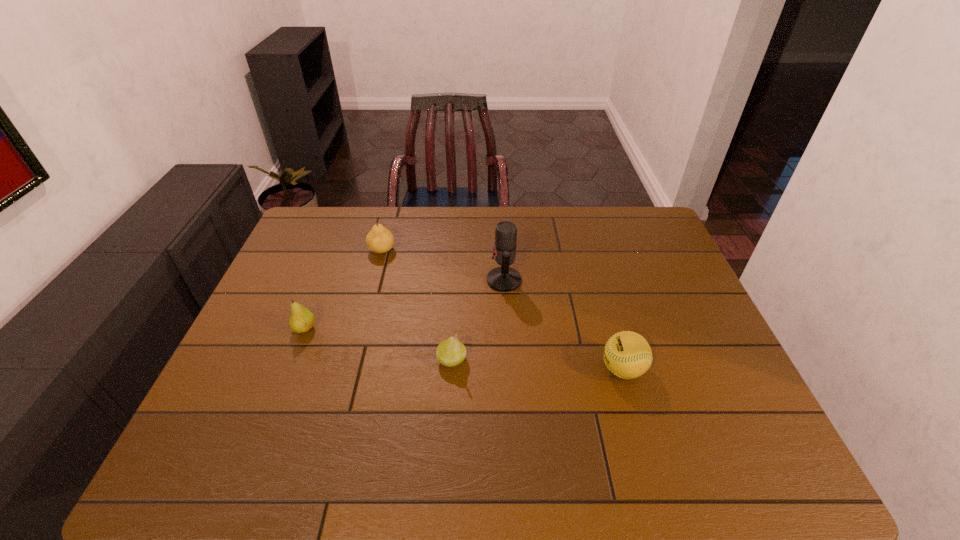
Locate an element on the screen. The height and width of the screenshot is (540, 960). the fourth closest object relative to the rightmost object is located at coordinates (301, 320).

Find the location of a particular element. The image size is (960, 540). the fourth closest object to the nearest pear is located at coordinates (379, 240).

Locate which pear is the third closest to the second object from right to left. Please provide its 2D coordinates. Your answer should be formatted as a tuple, i.e. [(x, y)], where the tuple contains the x and y coordinates of a point satisfying the conditions above.

[(301, 320)]

Identify which pear is the second closest to the farthest object. Please provide its 2D coordinates. Your answer should be formatted as a tuple, i.e. [(x, y)], where the tuple contains the x and y coordinates of a point satisfying the conditions above.

[(451, 352)]

Find the location of `blank space that satisfies the following two spatial constraints: 1. on the back side of the second pear from right to left; 2. on the left side of the third farthest object`. blank space that satisfies the following two spatial constraints: 1. on the back side of the second pear from right to left; 2. on the left side of the third farthest object is located at coordinates (335, 250).

The width and height of the screenshot is (960, 540). Identify the location of free spot that satisfies the following two spatial constraints: 1. on the side of the tallest object with the red ring; 2. on the front side of the leftmost pear. (507, 329).